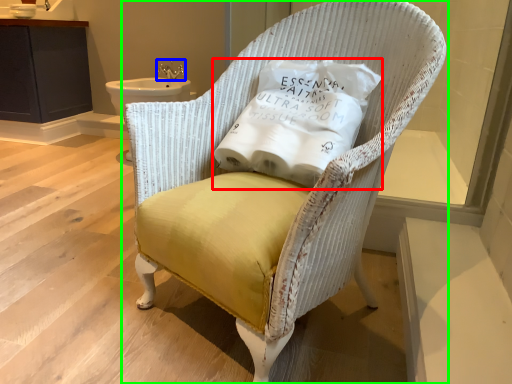
Question: Considering the real-world distances, which object is closest to pillow (highlighted by a red box)? faucet (highlighted by a blue box) or chair (highlighted by a green box).

Choices:
 (A) faucet
 (B) chair

Answer: (B)